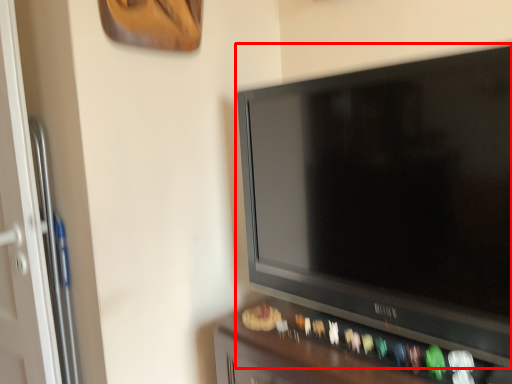
Question: Observing the image, what is the correct spatial positioning of television (annotated by the red box) in reference to furniture?

Choices:
 (A) left
 (B) right

Answer: (A)